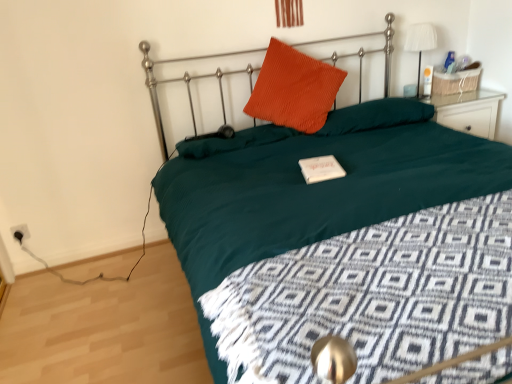
Question: Which is correct: orange corduroy pillow at upper center, the 1th pillow positioned from the right, is inside black plastic socket at lower left, or outside of it?

Choices:
 (A) outside
 (B) inside

Answer: (A)

Question: Is orange corduroy pillow at upper center, the 3th pillow in the left-to-right sequence, to the left or to the right of black plastic socket at lower left in the image?

Choices:
 (A) right
 (B) left

Answer: (A)

Question: Which is farther from the orange corduroy pillow at center, the first pillow when ordered from left to right?

Choices:
 (A) teal fabric bed at center
 (B) corduroy orange pillow at center, the second pillow from the right
 (C) white fabric lampshade at upper right
 (D) black plastic socket at lower left
 (E) orange corduroy pillow at upper center, the 3th pillow in the left-to-right sequence

Answer: (C)

Question: Which of these objects is positioned farthest from the orange corduroy pillow at upper center, the 1th pillow positioned from the right?

Choices:
 (A) black plastic socket at lower left
 (B) orange corduroy pillow at center, the first pillow when ordered from left to right
 (C) corduroy orange pillow at center, the second pillow from the right
 (D) white fabric lampshade at upper right
 (E) teal fabric bed at center

Answer: (A)